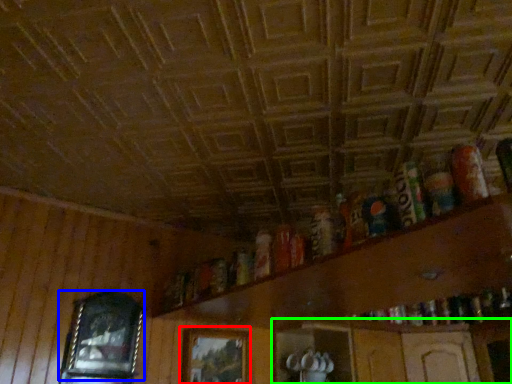
Question: Which object is positioned farthest from picture frame (highlighted by a red box)? Select from picture frame (highlighted by a blue box) and shelf (highlighted by a green box).

Choices:
 (A) picture frame
 (B) shelf

Answer: (B)